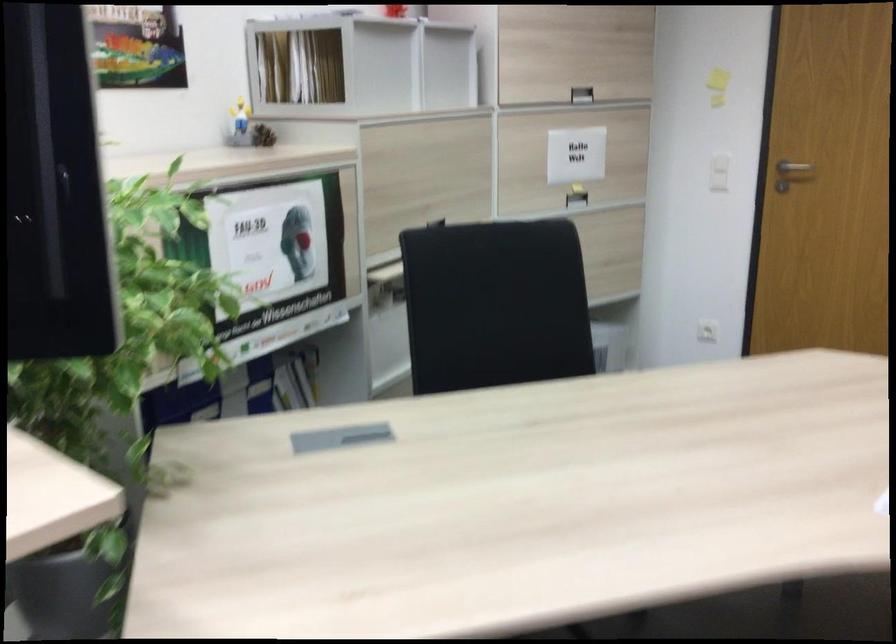
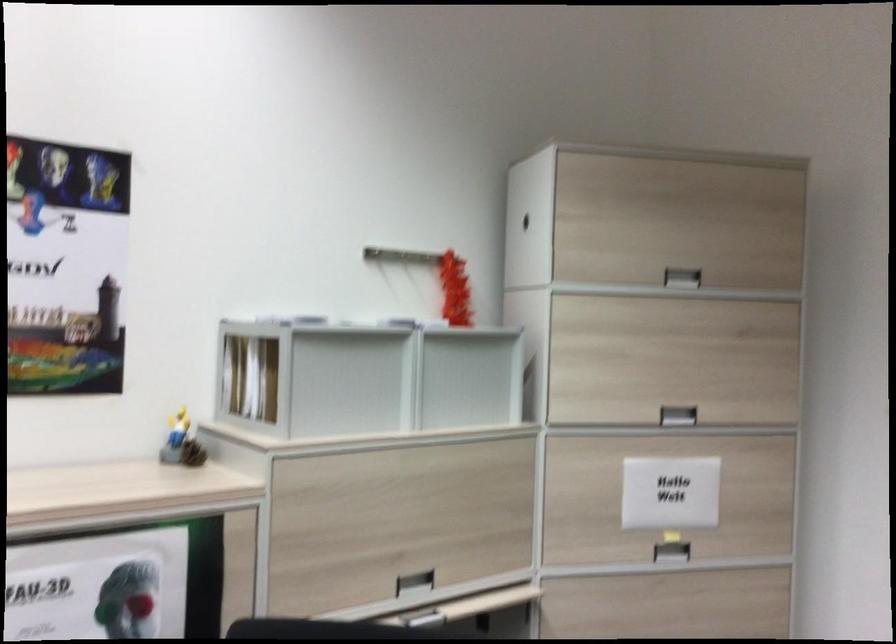
The point at [246,131] is marked in the first image. Where is the corresponding point in the second image?

(181, 442)